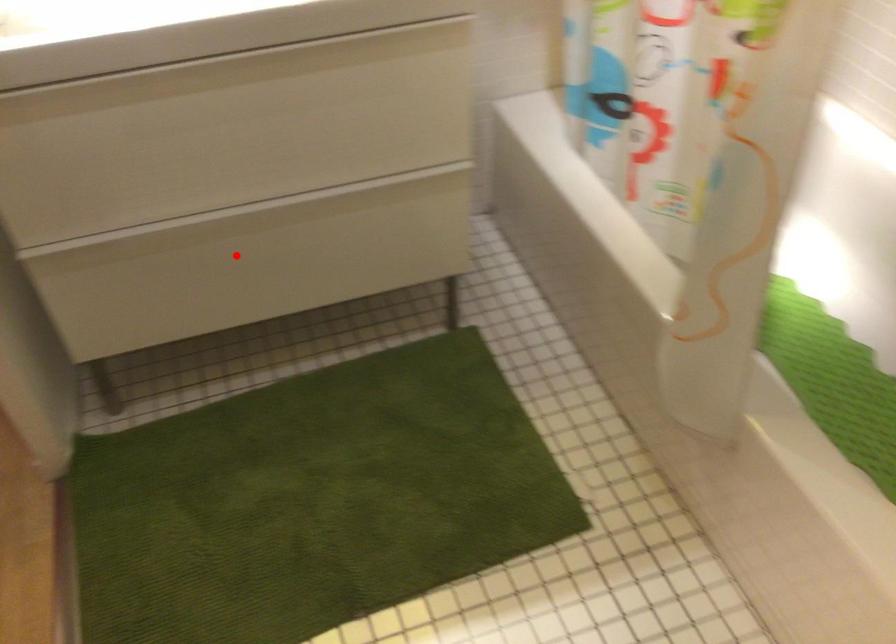
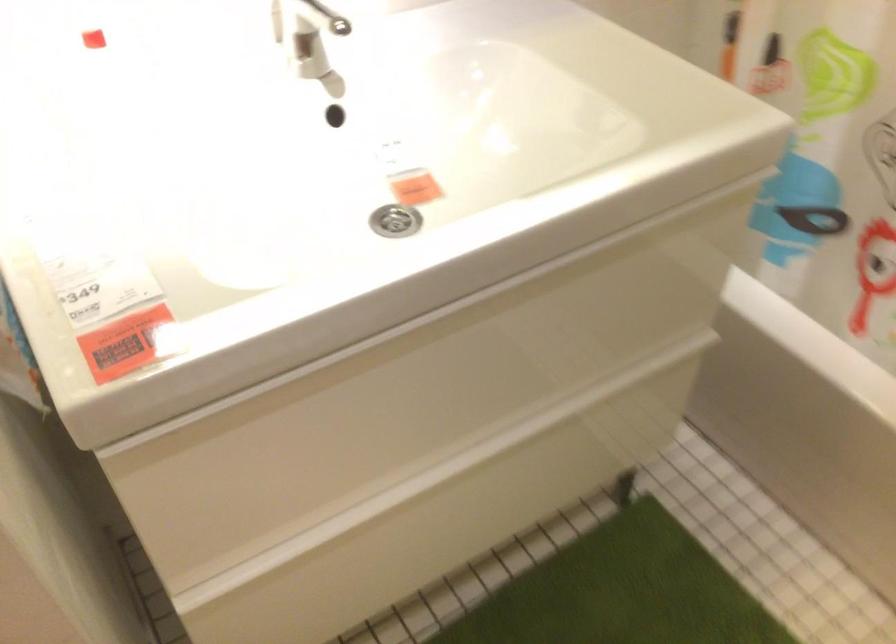
In the second image, find the point that corresponds to the highlighted location in the first image.

(442, 514)